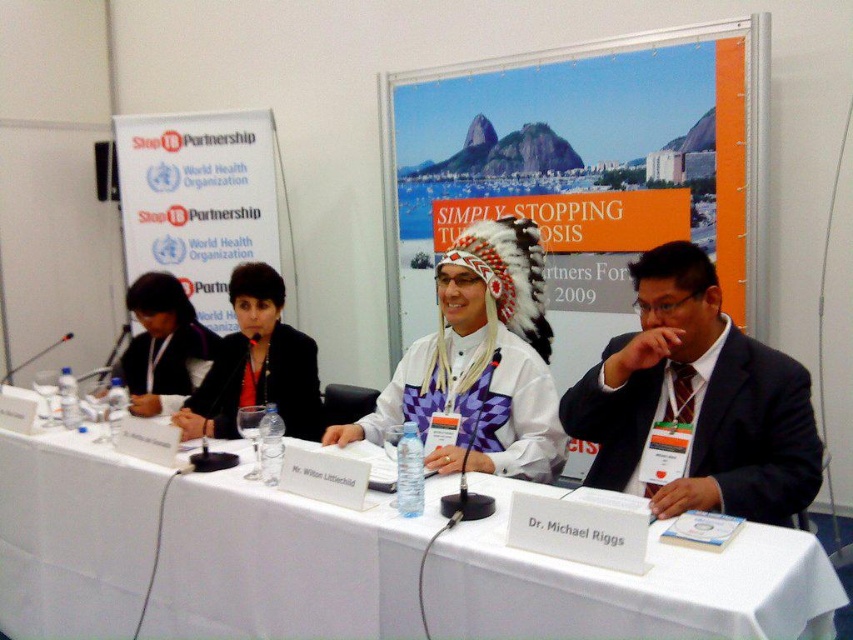
From the picture: Can you confirm if white feather headdress at center is thinner than black fabric jacket at upper left?

No, white feather headdress at center is not thinner than black fabric jacket at upper left.

Is white feather headdress at center to the right of black fabric jacket at upper left from the viewer's perspective?

Yes, white feather headdress at center is to the right of black fabric jacket at upper left.

You are a GUI agent. You are given a task and a screenshot of the screen. Output one action in this format:
    pyautogui.click(x=<x>, y=<y>)
    Task: Click on the white feather headdress at center
    This screenshot has width=853, height=640.
    Given the screenshot: What is the action you would take?
    pyautogui.click(x=480, y=360)

Looking at this image, does black suit at right lie in front of matte black jacket at upper left?

Yes.

Which is in front, point (636, 282) or point (146, 394)?

Point (636, 282) is more forward.

Where is `black suit at right`? black suit at right is located at coordinates (698, 401).

Is white feather headdress at center positioned before matte black jacket at upper left?

That is True.

Between white feather headdress at center and matte black jacket at upper left, which one has less height?

With less height is matte black jacket at upper left.

Is point (534, 307) farther from camera compared to point (202, 330)?

No.

At what (x,y) coordinates should I click in order to perform the action: click on white feather headdress at center. Please return your answer as a coordinate pair (x, y). The height and width of the screenshot is (640, 853). Looking at the image, I should click on click(480, 360).